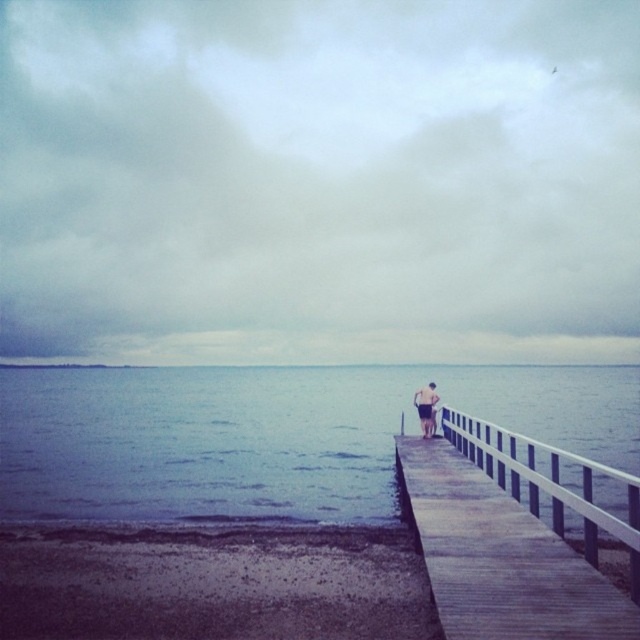
You are standing on the wooden pier in the coastal scene. You notice two points marked on the pier. The first point is at coordinates point (493, 528) and the second is at point (422, 428). Which point is closer to you as you stand on the pier?

Point (493, 528) is closer to the camera than point 0.661, so the first point is closer to you.

You are standing on the wooden dock at right and want to walk to the light brown wooden boardwalk at center. Which direction should you move to reach the boardwalk?

You should move to the left to reach the light brown wooden boardwalk at center because the wooden dock at right is positioned to the right of the boardwalk.

You are standing at the point labeled as point (269, 435) in the image. What do you see directly in front of you?

You see blue water at center directly in front of you at point (269, 435).